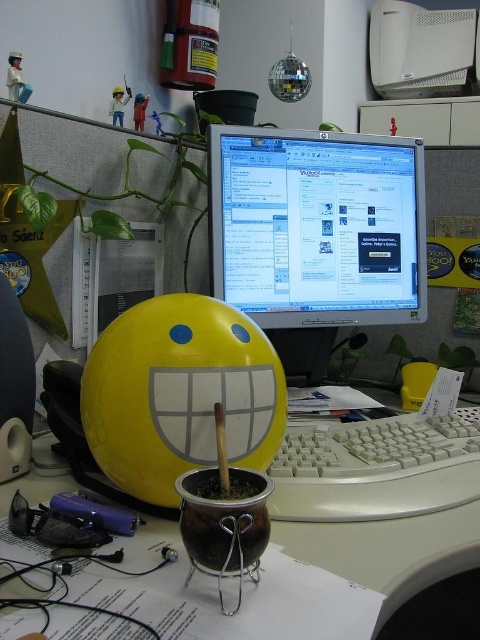
You are organizing your desk and want to place the brown ceramic pot at center and the white plastic keyboard at center side by side. Which object requires more horizontal space due to its width?

The brown ceramic pot at center requires more horizontal space because its width surpasses that of the white plastic keyboard at center.

Consider the image. You are organizing your desk and want to place the white plastic keyboard at center and the white plastic desktop computer at upper center into a storage box. If the box can only fit items smaller than the computer, will both items fit?

The white plastic keyboard at center is smaller than the white plastic desktop computer at upper center, so only the keyboard will fit into the box. The computer is too large to be stored in the box.